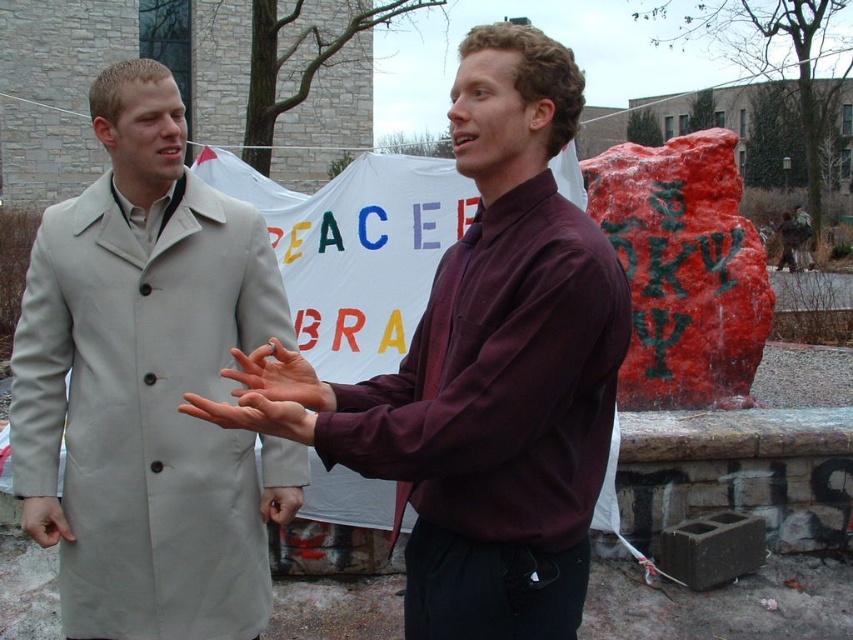
Is the position of maroon shirt at center less distant than that of light beige trench coat at left?

Yes, maroon shirt at center is in front of light beige trench coat at left.

Between maroon shirt at center and light beige trench coat at left, which one is positioned lower?

Positioned lower is light beige trench coat at left.

Does point (375, 417) come closer to viewer compared to point (131, 285)?

Yes, point (375, 417) is closer to viewer.

In order to click on maroon shirt at center in this screenshot , I will do `click(500, 369)`.

Between light beige trench coat at left and smooth skin hand at center, which one is positioned higher?

light beige trench coat at left is above.

Who is more forward, (222, 467) or (329, 394)?

Point (329, 394)

The image size is (853, 640). Describe the element at coordinates (148, 385) in the screenshot. I see `light beige trench coat at left` at that location.

The width and height of the screenshot is (853, 640). I want to click on light beige trench coat at left, so click(148, 385).

Is light beige trench coat at left below matte skin hand at center?

Incorrect, light beige trench coat at left is not positioned below matte skin hand at center.

Who is more forward, (189, 486) or (305, 417)?

Point (305, 417)

Where is `light beige trench coat at left`? This screenshot has height=640, width=853. light beige trench coat at left is located at coordinates (148, 385).